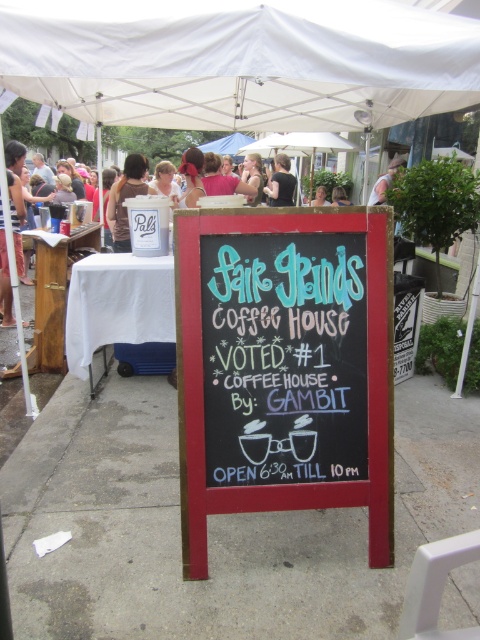
Question: Which of the following is the closest to the observer?

Choices:
 (A) (279, 182)
 (B) (205, 592)
 (C) (23, 259)
 (D) (173, 192)

Answer: (B)

Question: Does white cloth-covered table at center appear on the left side of white wood table at left?

Choices:
 (A) yes
 (B) no

Answer: (B)

Question: Is black chalkboard at center thinner than white fabric canopy at upper center?

Choices:
 (A) yes
 (B) no

Answer: (A)

Question: Based on their relative distances, which object is farther from the chalkboard sign at center?

Choices:
 (A) matte white shirt at center
 (B) white cotton shirt at left

Answer: (A)

Question: Does matte white shirt at center appear over light brown hair at upper center?

Choices:
 (A) yes
 (B) no

Answer: (A)

Question: Among these points, which one is farthest from the camera?

Choices:
 (A) (59, 36)
 (B) (41, 364)
 (C) (67, 604)

Answer: (B)